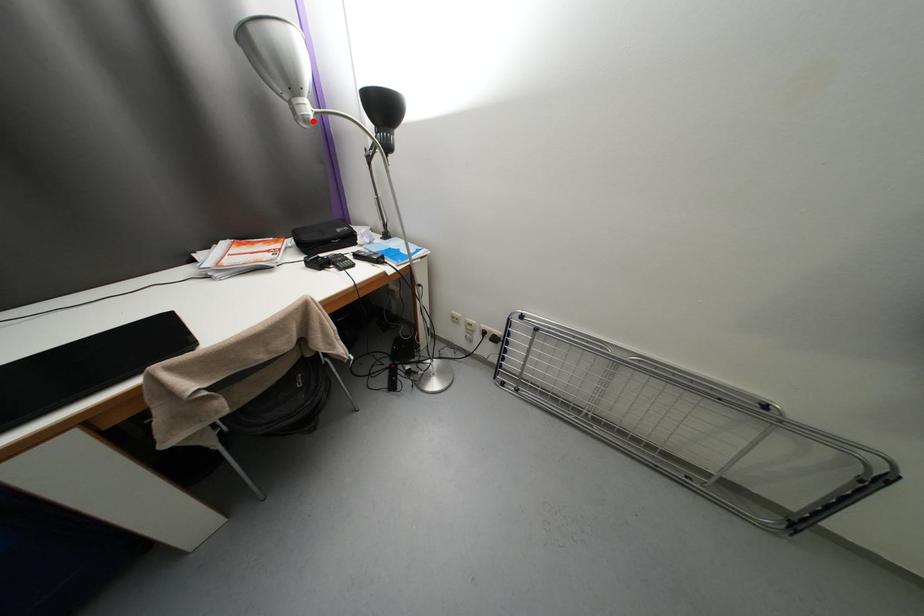
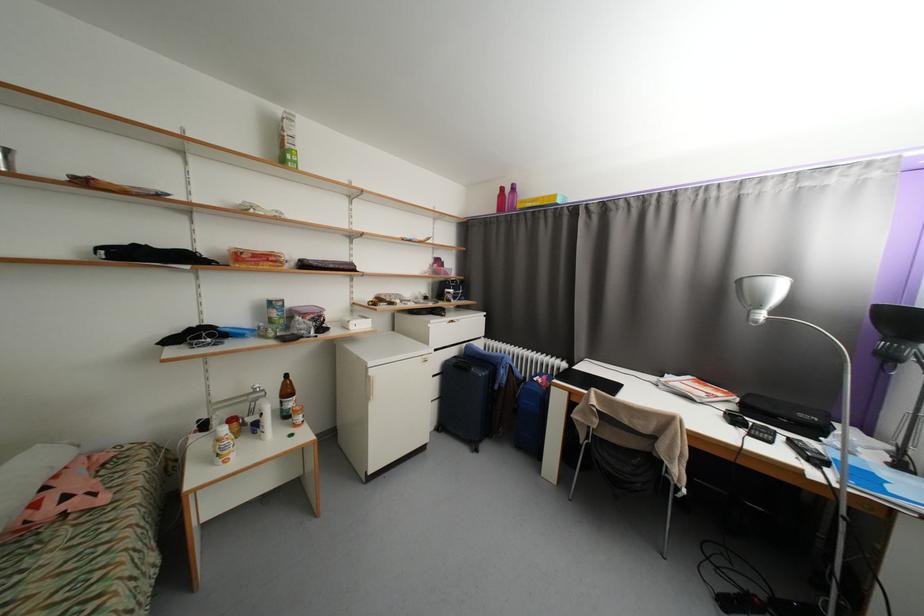
Where in the second image is the point corresponding to the highlighted location from the first image?

(761, 323)